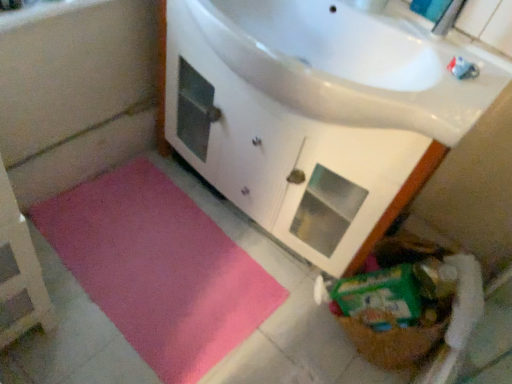
I want to click on vacant area that lies between pink fabric bath mat at lower left and pink plush bath mat at lower left, so click(x=184, y=196).